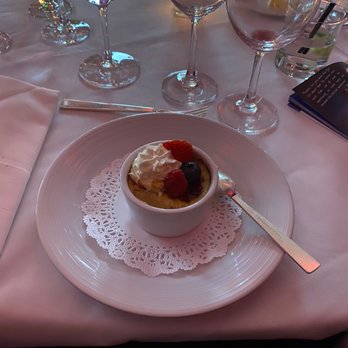
Where is `plate`? This screenshot has height=348, width=348. plate is located at coordinates pos(216,290).